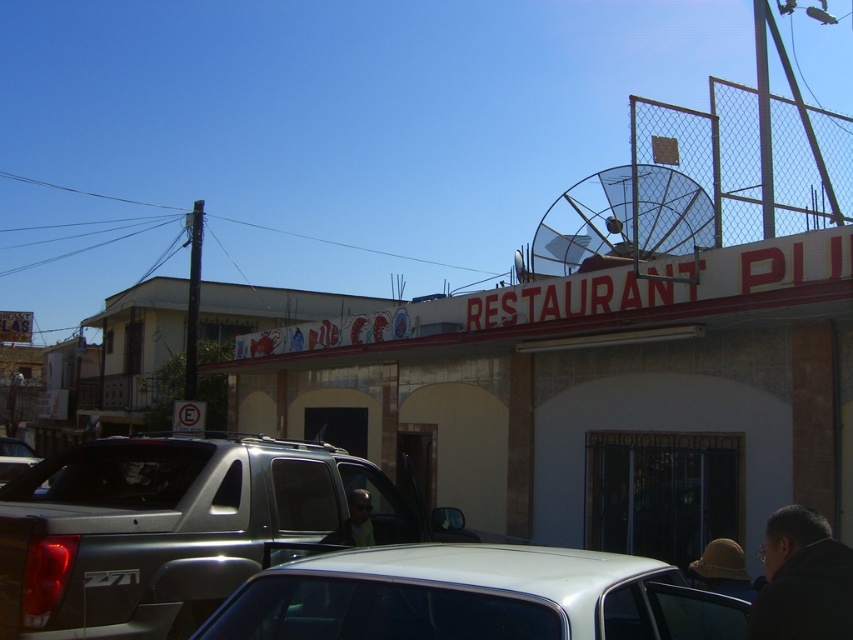
You are standing at the entrance of the restaurant and want to place a new menu board on the wall. The menu board requires a space that is at least 0.9 meters from the bottom edge of the wall. Is the dark gray jacket at lower right currently occupying a spot that would interfere with this requirement?

The dark gray jacket at lower right is positioned at point 0.908 on the vertical axis, which is above 0.9 meters from the bottom edge. Therefore, placing the menu board at the required height would not interfere with the dark gray jacket at lower right.

You are a customer standing in front of the restaurant and want to check if there is space to park your car between the dark gray jacket at lower right and the brown felt hat at lower right. Can you tell me if there is enough space?

The dark gray jacket at lower right is positioned on the left side of brown felt hat at lower right, so there is space between them for parking your car.